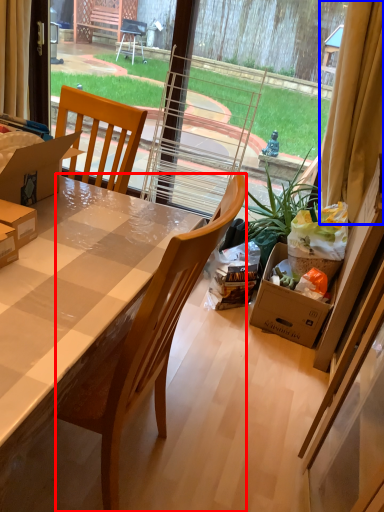
Question: Among these objects, which one is nearest to the camera, chair (highlighted by a red box) or curtain (highlighted by a blue box)?

Choices:
 (A) chair
 (B) curtain

Answer: (A)